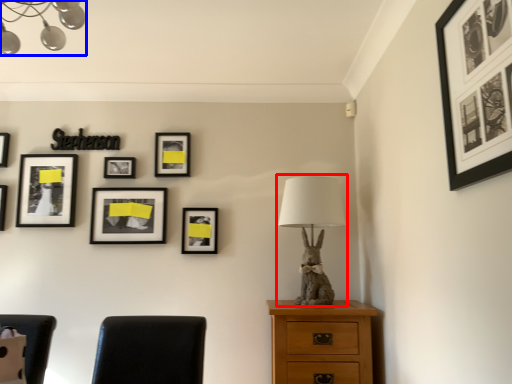
Question: Which point is closer to the camera, table lamp (highlighted by a red box) or lamp (highlighted by a blue box)?

Choices:
 (A) table lamp
 (B) lamp

Answer: (B)